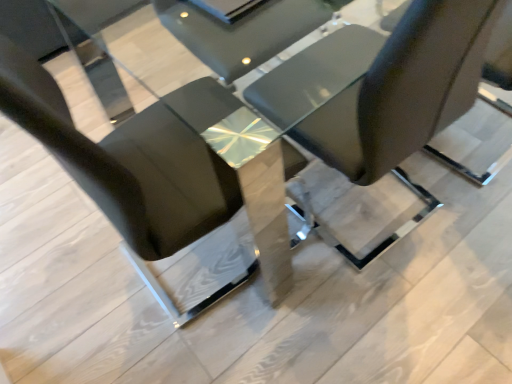
Question: Which direction should I rotate to look at black leather chair at center, which is the 2th chair from right to left, — up or down?

Choices:
 (A) up
 (B) down

Answer: (A)

Question: Which direction should I rotate to look at matte black chair at center, the 1th chair in the right-to-left sequence, — up or down?

Choices:
 (A) up
 (B) down

Answer: (A)

Question: From the image's perspective, is matte black chair at center, the 1th chair in the right-to-left sequence, located beneath black leather chair at center, arranged as the 1th chair when viewed from the left?

Choices:
 (A) yes
 (B) no

Answer: (B)

Question: Is matte black chair at center, the 1th chair in the right-to-left sequence, far away from black leather chair at center, which is the 2th chair from right to left?

Choices:
 (A) no
 (B) yes

Answer: (A)

Question: Considering the relative sizes of matte black chair at center, the second chair in the left-to-right sequence, and black leather chair at center, which is the 2th chair from right to left, in the image provided, is matte black chair at center, the second chair in the left-to-right sequence, taller than black leather chair at center, which is the 2th chair from right to left,?

Choices:
 (A) no
 (B) yes

Answer: (A)

Question: Would you say matte black chair at center, the 1th chair in the right-to-left sequence, contains black leather chair at center, arranged as the 1th chair when viewed from the left?

Choices:
 (A) no
 (B) yes

Answer: (A)

Question: Does matte black chair at center, the 1th chair in the right-to-left sequence, have a lesser width compared to black leather chair at center, which is the 2th chair from right to left?

Choices:
 (A) no
 (B) yes

Answer: (B)

Question: From a real-world perspective, is matte black chair at center, the 1th chair in the right-to-left sequence, below black leather chair at center, arranged as the 1th chair when viewed from the left?

Choices:
 (A) no
 (B) yes

Answer: (B)

Question: Is black leather chair at center, which is the 2th chair from right to left, turned away from matte black chair at center, the 1th chair in the right-to-left sequence?

Choices:
 (A) yes
 (B) no

Answer: (B)

Question: Is black leather chair at center, which is the 2th chair from right to left, in contact with matte black chair at center, the 1th chair in the right-to-left sequence?

Choices:
 (A) yes
 (B) no

Answer: (B)

Question: Is black leather chair at center, which is the 2th chair from right to left, behind matte black chair at center, the 1th chair in the right-to-left sequence?

Choices:
 (A) yes
 (B) no

Answer: (B)

Question: Can you confirm if black leather chair at center, arranged as the 1th chair when viewed from the left, is positioned to the right of matte black chair at center, the second chair in the left-to-right sequence?

Choices:
 (A) no
 (B) yes

Answer: (A)

Question: Would you say matte black chair at center, the 1th chair in the right-to-left sequence, is part of black leather chair at center, which is the 2th chair from right to left,'s contents?

Choices:
 (A) yes
 (B) no

Answer: (B)

Question: Considering the relative sizes of black leather chair at center, arranged as the 1th chair when viewed from the left, and matte black chair at center, the second chair in the left-to-right sequence, in the image provided, is black leather chair at center, arranged as the 1th chair when viewed from the left, smaller than matte black chair at center, the second chair in the left-to-right sequence,?

Choices:
 (A) yes
 (B) no

Answer: (B)

Question: In terms of width, does black leather chair at center, arranged as the 1th chair when viewed from the left, look wider or thinner when compared to matte black chair at center, the 1th chair in the right-to-left sequence?

Choices:
 (A) thin
 (B) wide

Answer: (B)